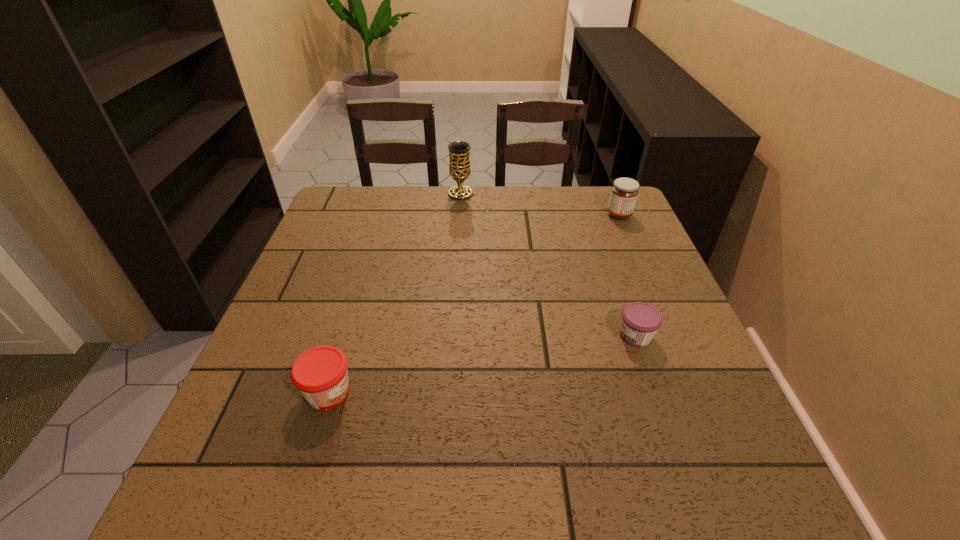
Locate an element on the screen. Image resolution: width=960 pixels, height=540 pixels. vacant region that satisfies the following two spatial constraints: 1. on the front side of the chalice; 2. on the right side of the third shortest object is located at coordinates (459, 215).

This screenshot has width=960, height=540. I want to click on free space that satisfies the following two spatial constraints: 1. on the front side of the farthest jam; 2. on the front label of the second farthest jam, so click(x=671, y=336).

Where is `vacant area in the image that satisfies the following two spatial constraints: 1. on the front side of the third shortest object; 2. on the label side of the third tallest object`? This screenshot has height=540, width=960. vacant area in the image that satisfies the following two spatial constraints: 1. on the front side of the third shortest object; 2. on the label side of the third tallest object is located at coordinates (696, 392).